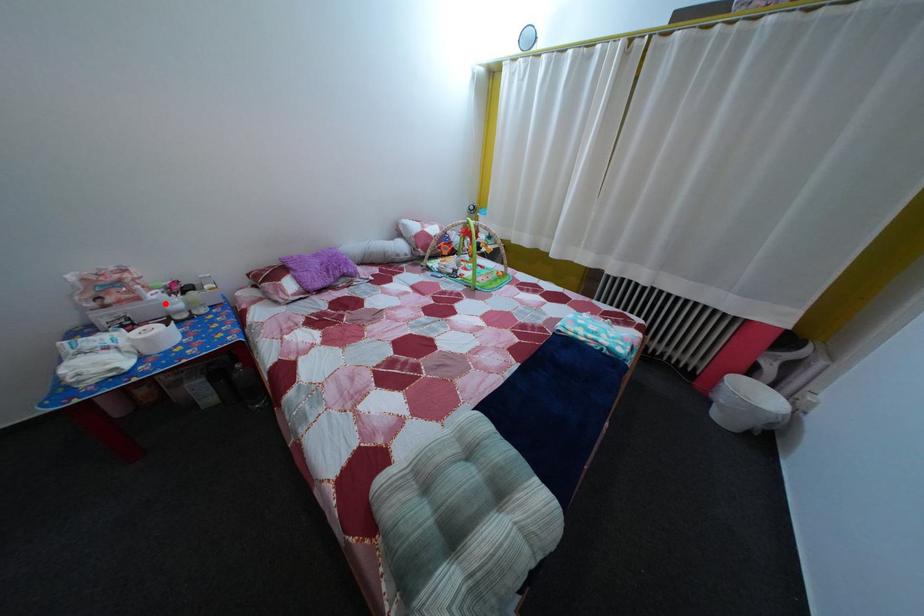
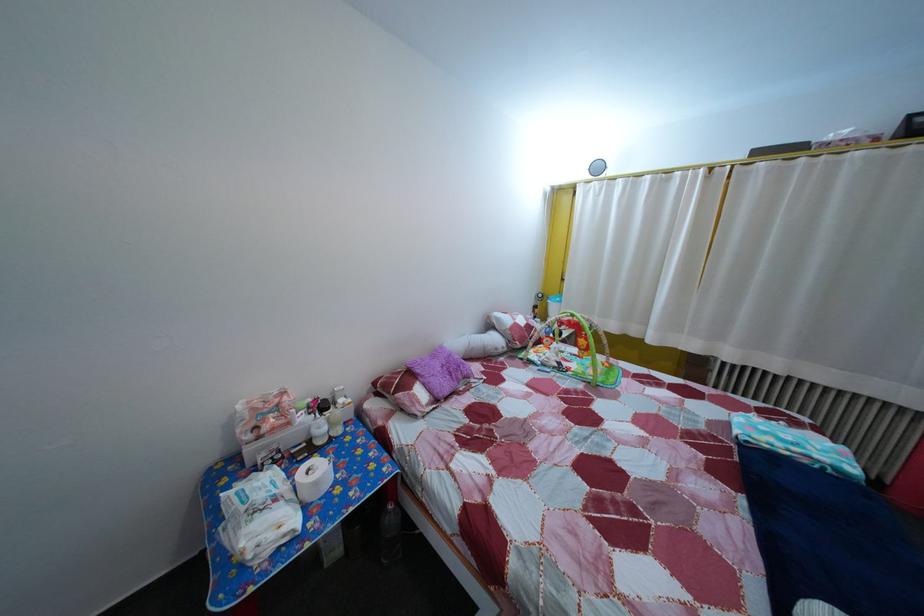
Find the pixel in the second image that matches the highlighted location in the first image.

(311, 427)